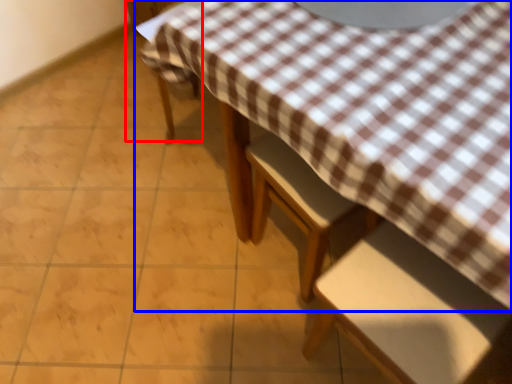
Question: Which object is further to the camera taking this photo, chair (highlighted by a red box) or table (highlighted by a blue box)?

Choices:
 (A) chair
 (B) table

Answer: (A)